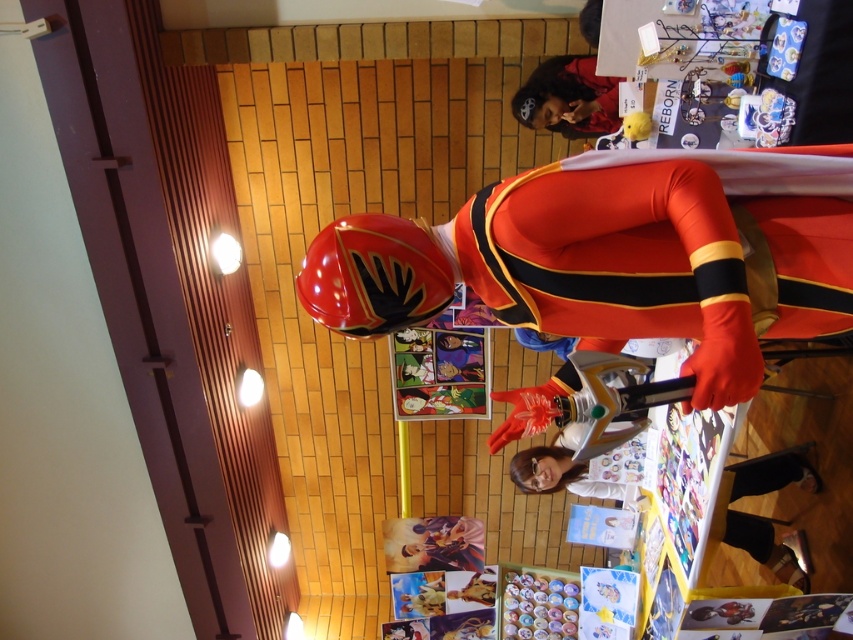
You are standing in the convention hall and notice a specific point marked at coordinates (618, 257). Based on the scene description, can you identify which object this point is located on?

The point at coordinates (618, 257) is on the shiny red helmet at upper center.

You are standing in the convention hall and notice a point marked at coordinates (x=764, y=547). According to the image, what object is located at that point?

The point at coordinates (x=764, y=547) marks the white glossy shirt at lower center.

You are standing in the convention hall and see the white glossy shirt at lower center and the matte black hairband at upper center. Which object is nearer to you?

The white glossy shirt at lower center is closer to the viewer than the matte black hairband at upper center.